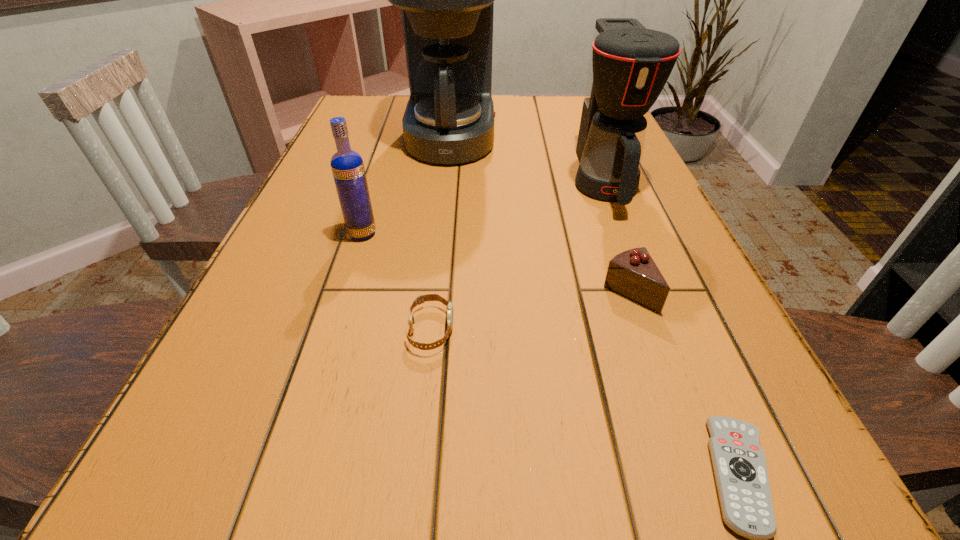
Where is `blank space located on the back of the vodka`? This screenshot has height=540, width=960. blank space located on the back of the vodka is located at coordinates (372, 201).

Identify the location of vacant space positioned on the back of the third shortest object. (602, 217).

Find the location of a particular element. This screenshot has height=540, width=960. vacant region located on the face of the second shortest object is located at coordinates pyautogui.click(x=593, y=329).

The height and width of the screenshot is (540, 960). In order to click on object located in the far edge section of the desktop in this screenshot , I will do `click(447, 0)`.

Identify the location of object that is at the left edge. The width and height of the screenshot is (960, 540). (347, 166).

You are a GUI agent. You are given a task and a screenshot of the screen. Output one action in this format:
    pyautogui.click(x=<x>, y=<y>)
    Task: Click on the coffee maker that is at the right edge
    This screenshot has width=960, height=540.
    Given the screenshot: What is the action you would take?
    pyautogui.click(x=629, y=66)

Locate an element on the screen. The height and width of the screenshot is (540, 960). chocolate cake present at the right edge is located at coordinates (633, 273).

In the image, there is a desktop. Identify the location of free space at the far edge. The width and height of the screenshot is (960, 540). (551, 112).

Where is `vacant space at the left edge of the desktop`? vacant space at the left edge of the desktop is located at coordinates click(x=323, y=321).

The width and height of the screenshot is (960, 540). I want to click on blank space at the right edge, so click(666, 212).